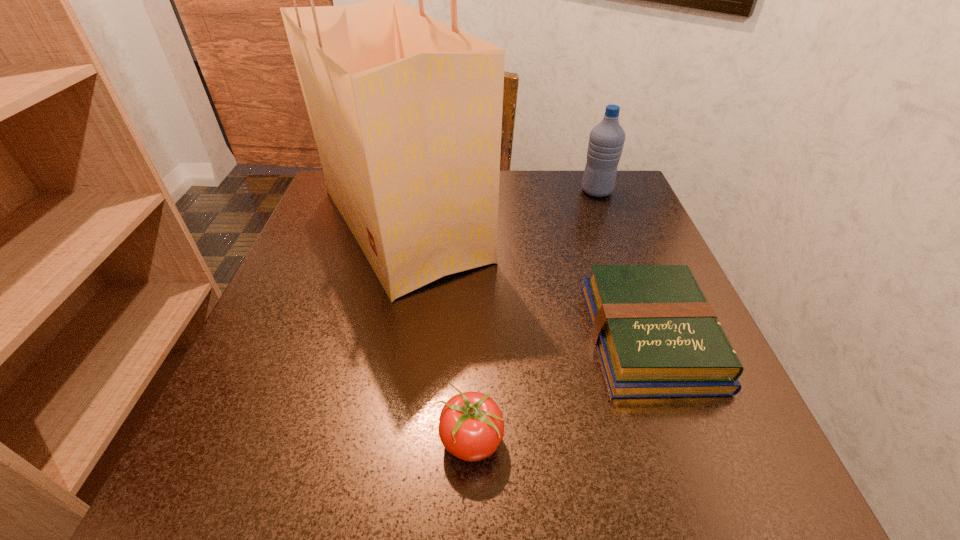
Identify the location of the tallest object. (406, 111).

Image resolution: width=960 pixels, height=540 pixels. In order to click on the second tallest object in this screenshot , I will do `click(606, 141)`.

Where is `the nearest object`? The width and height of the screenshot is (960, 540). the nearest object is located at coordinates (471, 426).

At what (x,y) coordinates should I click in order to perform the action: click on tomato. Please return your answer as a coordinate pair (x, y). Looking at the image, I should click on click(x=471, y=426).

Find the location of a particular element. book is located at coordinates (657, 336).

Find the location of a particular element. Image resolution: width=960 pixels, height=540 pixels. vacant space located 0.150m on the side of the tallest object with the superhero design is located at coordinates (564, 225).

The image size is (960, 540). Identify the location of blank area located 0.110m on the front of the water bottle. (611, 227).

You are a GUI agent. You are given a task and a screenshot of the screen. Output one action in this format:
    pyautogui.click(x=<x>, y=<y>)
    Task: Click on the vacant area situated on the left of the tomato
    The height and width of the screenshot is (540, 960).
    Given the screenshot: What is the action you would take?
    pyautogui.click(x=332, y=441)

The image size is (960, 540). Identify the location of vacant space located 0.350m on the left of the shortest object. [x=379, y=336].

Where is `grocery bag that is positioned at the far edge`? grocery bag that is positioned at the far edge is located at coordinates (406, 111).